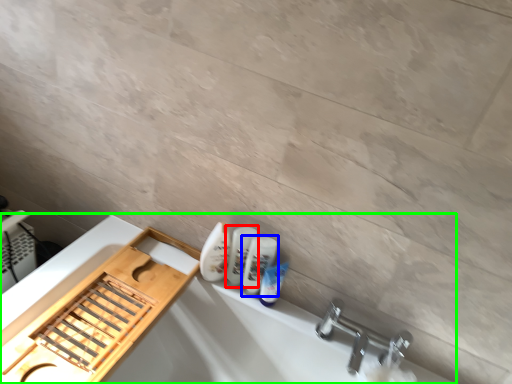
Question: Which is farther away from mouthwash (highlighted by a red box)? mouthwash (highlighted by a blue box) or bath (highlighted by a green box)?

Choices:
 (A) mouthwash
 (B) bath

Answer: (B)